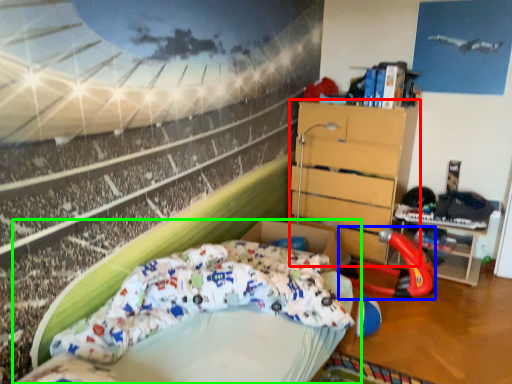
Question: Estimate the real-world distances between objects in this image. Which object is closer to chest of drawers (highlighted by a red box), sport equipment (highlighted by a blue box) or bed (highlighted by a green box)?

Choices:
 (A) sport equipment
 (B) bed

Answer: (A)